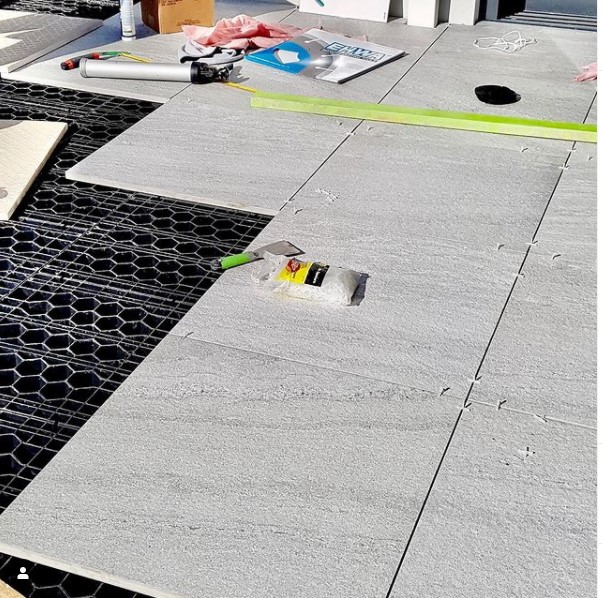
Where is `doorway`? The width and height of the screenshot is (603, 598). doorway is located at coordinates tap(567, 18).